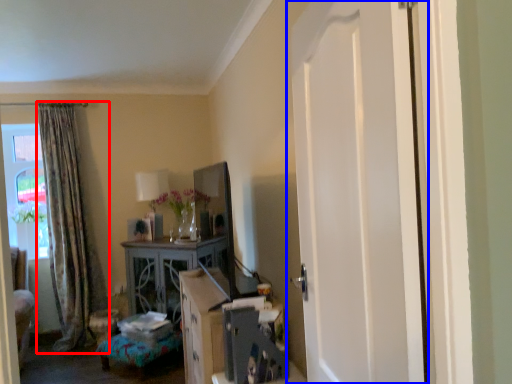
Question: Which of the following is the closest to the observer, curtain (highlighted by a red box) or door (highlighted by a blue box)?

Choices:
 (A) curtain
 (B) door

Answer: (B)